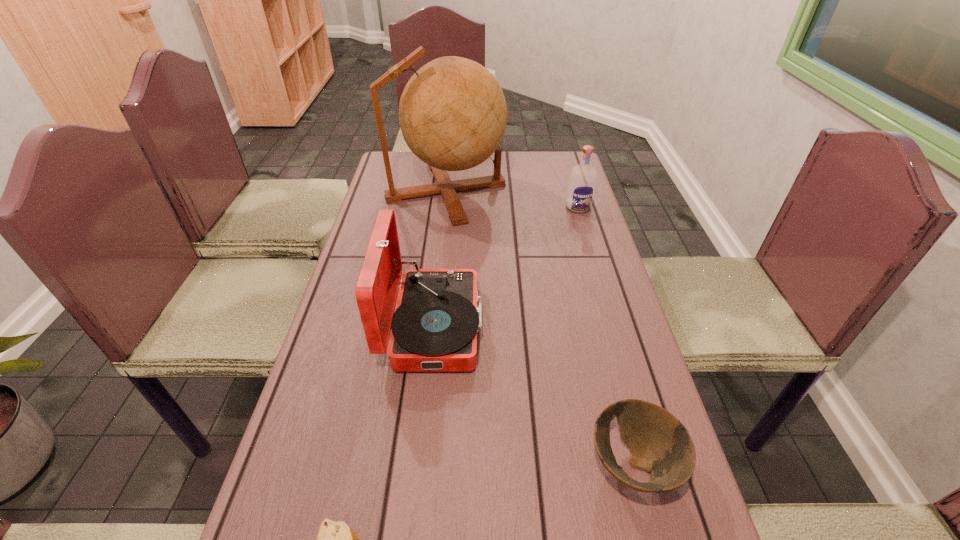
Where is `vacant space that satisfies the following two spatial constraints: 1. on the front-facing side of the third farthest object; 2. on the left side of the fourth tallest object`? vacant space that satisfies the following two spatial constraints: 1. on the front-facing side of the third farthest object; 2. on the left side of the fourth tallest object is located at coordinates coord(419,465).